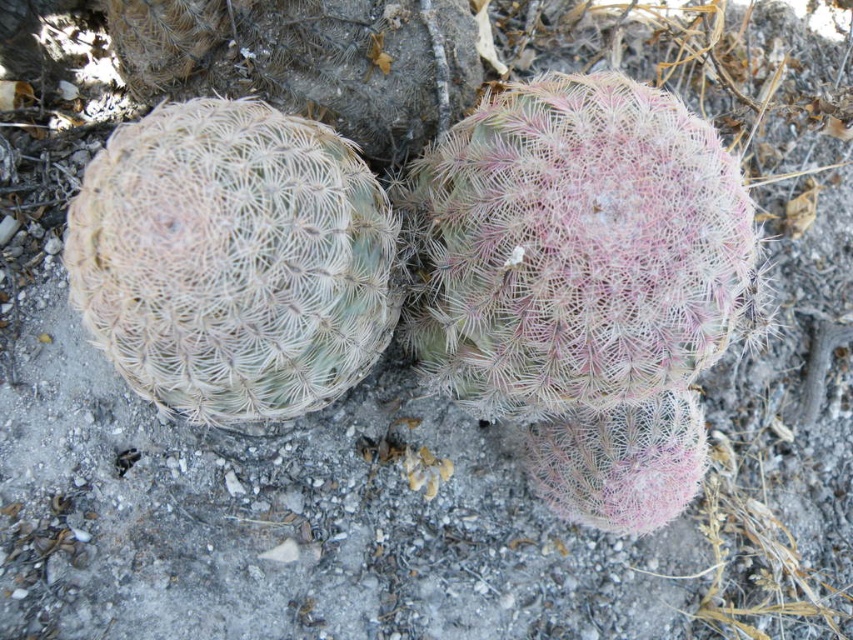
Locate an element on the screen. The image size is (853, 640). pink spiky cactus at center is located at coordinates (584, 284).

Is pink spiky cactus at center shorter than white spiky cactus at left?

No.

This screenshot has width=853, height=640. Describe the element at coordinates (584, 284) in the screenshot. I see `pink spiky cactus at center` at that location.

Locate an element on the screen. This screenshot has height=640, width=853. pink spiky cactus at center is located at coordinates (584, 284).